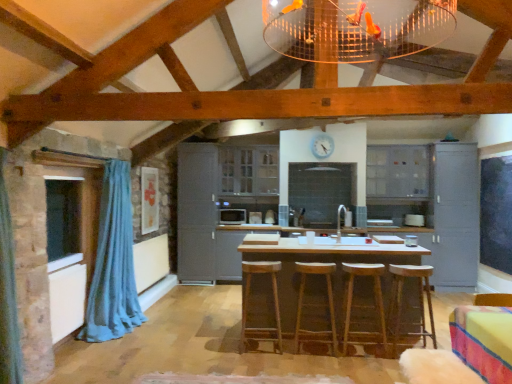
This screenshot has width=512, height=384. In order to click on free space in front of blue fabric curtain at left in this screenshot , I will do `click(106, 352)`.